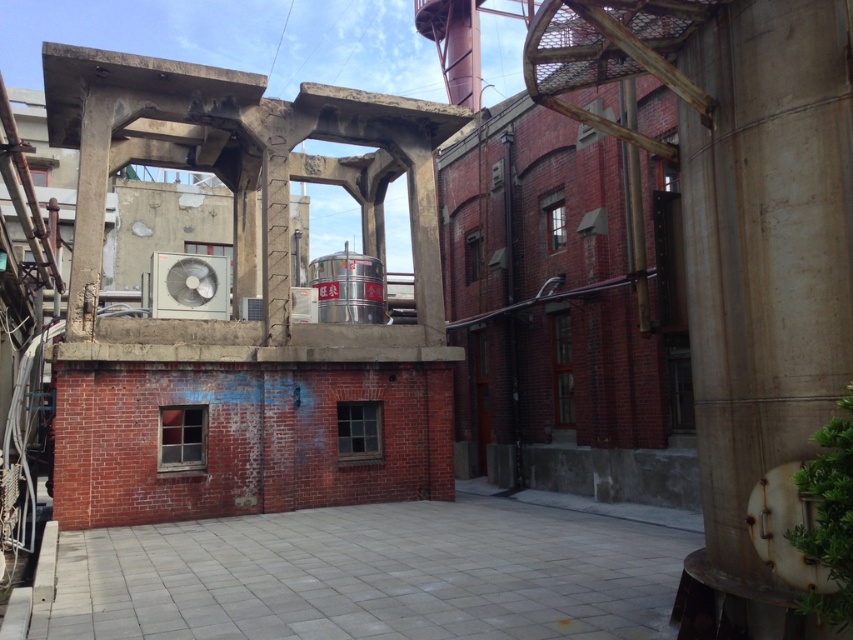
You are a delivery person trying to navigate through the gray concrete alley at center. There is a smooth concrete pillar at center right in your path. Given that your delivery cart is 1 meter wide, can you pass through the alley without hitting the pillar?

The smooth concrete pillar at center right is thinner than the gray concrete alley at center. Since the alley is wider than the pillar, and your cart is 1 meter wide, you can pass through the alley as long as you stay centered and avoid the pillar.